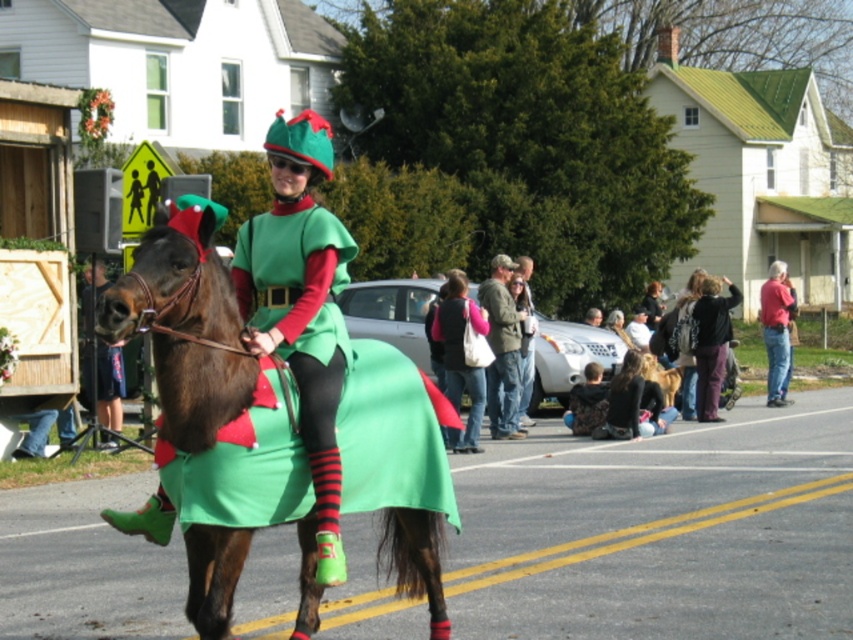
Question: Which object appears closest to the camera in this image?

Choices:
 (A) purple fleece jacket at center
 (B) red shirt at right
 (C) shiny brown horse at center

Answer: (C)

Question: Which point is farther to the camera?

Choices:
 (A) camouflage jacket at center
 (B) shiny brown horse at center

Answer: (A)

Question: Can you confirm if purple fleece jacket at center is bigger than red shirt at right?

Choices:
 (A) no
 (B) yes

Answer: (A)

Question: Is camouflage jacket at center to the left of denim jacket at center from the viewer's perspective?

Choices:
 (A) no
 (B) yes

Answer: (A)

Question: Can you confirm if shiny brown horse at center is bigger than denim jacket at center?

Choices:
 (A) yes
 (B) no

Answer: (A)

Question: Considering the real-world distances, which object is closest to the green matte dress at center?

Choices:
 (A) camouflage jacket at center
 (B) denim jacket at center

Answer: (B)